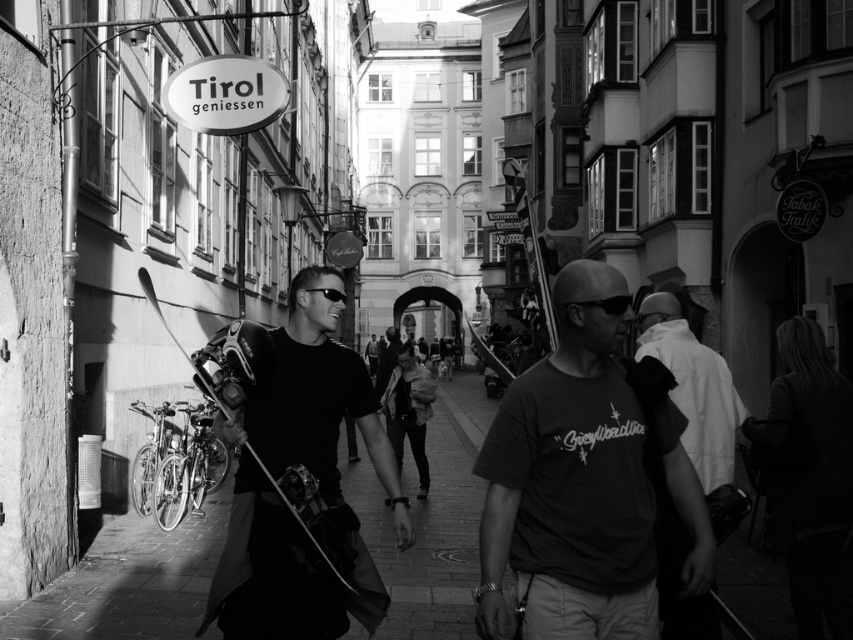
Does dark fabric bag at right have a smaller size compared to white cotton shirt at right?

Indeed, dark fabric bag at right has a smaller size compared to white cotton shirt at right.

Who is more distant from viewer, [810,378] or [686,611]?

Positioned behind is point [810,378].

Where is `dark fabric bag at right`? This screenshot has height=640, width=853. dark fabric bag at right is located at coordinates (809, 476).

Is dark gray t-shirt at center taller than white cotton shirt at right?

In fact, dark gray t-shirt at center may be shorter than white cotton shirt at right.

Can you confirm if dark gray t-shirt at center is positioned below white cotton shirt at right?

Yes.

Who is more distant from viewer, (x=485, y=545) or (x=657, y=307)?

Positioned behind is point (x=657, y=307).

At what (x,y) coordinates should I click in order to perform the action: click on dark gray t-shirt at center. Please return your answer as a coordinate pair (x, y). Looking at the image, I should click on (570, 483).

Looking at this image, measure the distance between dark gray t-shirt at center and camera.

A distance of 16.81 meters exists between dark gray t-shirt at center and camera.

This screenshot has height=640, width=853. What do you see at coordinates (570, 483) in the screenshot?
I see `dark gray t-shirt at center` at bounding box center [570, 483].

The image size is (853, 640). What do you see at coordinates (570, 483) in the screenshot?
I see `dark gray t-shirt at center` at bounding box center [570, 483].

In order to click on dark gray t-shirt at center in this screenshot , I will do `click(570, 483)`.